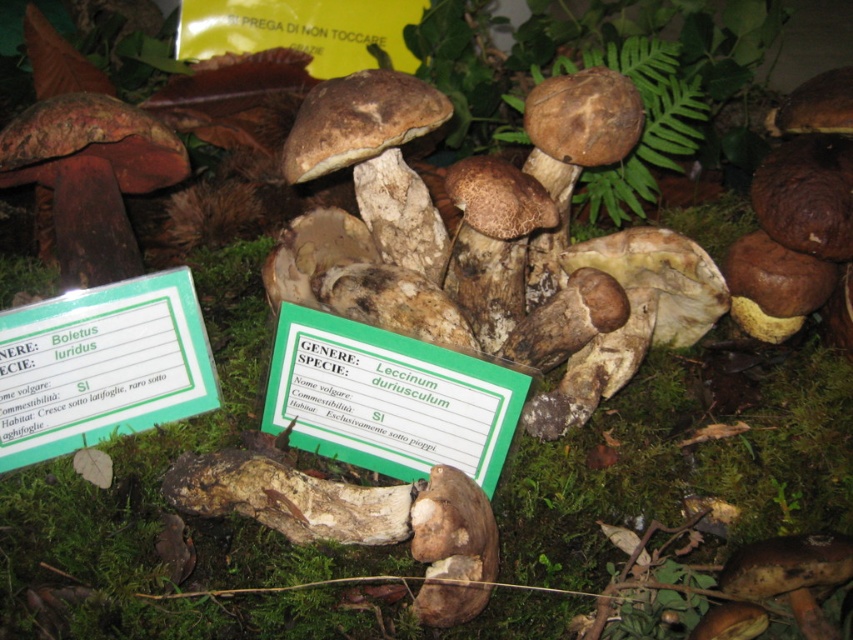
Looking at this image, you are a visitor at the exhibit and want to read the green paper sign at lower left. However, you notice the green leafy fern at upper center is blocking your view. Can you determine if the sign is taller than the fern?

The green paper sign at lower left is not as tall as green leafy fern at upper center, so the fern is taller and may be blocking the sign.

You are a visitor at the exhibit and want to read the green paper sign at center. Can you read it clearly from where you are standing?

The green paper sign at center is 1.19 meters away from camera, so yes, you can read it clearly from your current position.